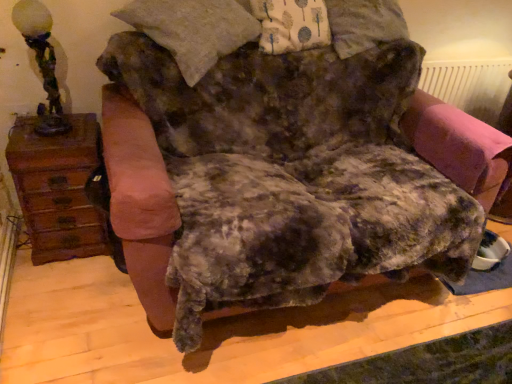
Question: Is pink plastic radiator at upper right shorter than antique bronze lamp at left?

Choices:
 (A) yes
 (B) no

Answer: (A)

Question: Does pink plastic radiator at upper right have a lesser width compared to antique bronze lamp at left?

Choices:
 (A) no
 (B) yes

Answer: (B)

Question: From the image's perspective, is pink plastic radiator at upper right below antique bronze lamp at left?

Choices:
 (A) no
 (B) yes

Answer: (A)

Question: Considering the relative sizes of pink plastic radiator at upper right and antique bronze lamp at left in the image provided, is pink plastic radiator at upper right taller than antique bronze lamp at left?

Choices:
 (A) yes
 (B) no

Answer: (B)

Question: From a real-world perspective, is pink plastic radiator at upper right over antique bronze lamp at left?

Choices:
 (A) no
 (B) yes

Answer: (A)

Question: Considering the positions of point (433, 94) and point (16, 170), is point (433, 94) closer or farther from the camera than point (16, 170)?

Choices:
 (A) farther
 (B) closer

Answer: (A)

Question: From their relative heights in the image, would you say pink plastic radiator at upper right is taller or shorter than brown wood dresser at left?

Choices:
 (A) tall
 (B) short

Answer: (B)

Question: Is pink plastic radiator at upper right in front of or behind brown wood dresser at left in the image?

Choices:
 (A) front
 (B) behind

Answer: (B)

Question: Visually, is pink plastic radiator at upper right positioned to the left or to the right of brown wood dresser at left?

Choices:
 (A) left
 (B) right

Answer: (B)

Question: From a real-world perspective, relative to brown wood dresser at left, is antique bronze lamp at left vertically above or below?

Choices:
 (A) below
 (B) above

Answer: (B)

Question: Is point (32, 38) positioned closer to the camera than point (66, 137)?

Choices:
 (A) farther
 (B) closer

Answer: (B)

Question: Is antique bronze lamp at left taller or shorter than brown wood dresser at left?

Choices:
 (A) tall
 (B) short

Answer: (B)

Question: Is antique bronze lamp at left in front of or behind brown wood dresser at left in the image?

Choices:
 (A) front
 (B) behind

Answer: (A)

Question: From a real-world perspective, is antique bronze lamp at left positioned above or below pink fabric swivel chair at right?

Choices:
 (A) above
 (B) below

Answer: (A)

Question: From the image's perspective, is antique bronze lamp at left located above or below pink fabric swivel chair at right?

Choices:
 (A) below
 (B) above

Answer: (B)